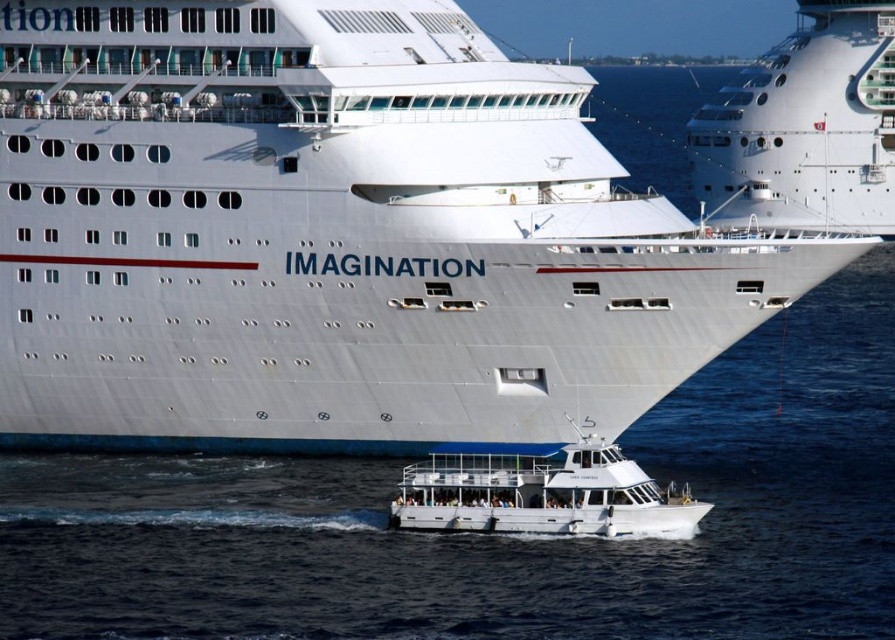
Does white glossy ship at upper center have a greater height compared to white matte boat at lower center?

Indeed, white glossy ship at upper center has a greater height compared to white matte boat at lower center.

Can you confirm if white glossy ship at upper center is positioned above white matte boat at lower center?

Indeed, white glossy ship at upper center is positioned over white matte boat at lower center.

Find the location of a particular element. The height and width of the screenshot is (640, 895). white glossy ship at upper center is located at coordinates (806, 128).

I want to click on white glossy ship at upper center, so click(806, 128).

Is point (335, 83) in front of point (742, 483)?

Yes, it is.

Does white glossy cruise ship at center appear on the right side of clear blue water at center?

In fact, white glossy cruise ship at center is to the left of clear blue water at center.

Between point (303, 358) and point (322, 547), which one is positioned behind?

The point (303, 358) is more distant.

At what (x,y) coordinates should I click in order to perform the action: click on white glossy cruise ship at center. Please return your answer as a coordinate pair (x, y). The height and width of the screenshot is (640, 895). Looking at the image, I should click on (337, 236).

Who is more forward, (249, 465) or (861, 152)?

Point (249, 465) is more forward.

Is clear blue water at center closer to camera compared to white glossy ship at upper center?

Yes, clear blue water at center is closer to the viewer.

Is point (222, 621) more distant than point (812, 28)?

No, it is in front of (812, 28).

Locate an element on the screen. Image resolution: width=895 pixels, height=640 pixels. clear blue water at center is located at coordinates (499, 538).